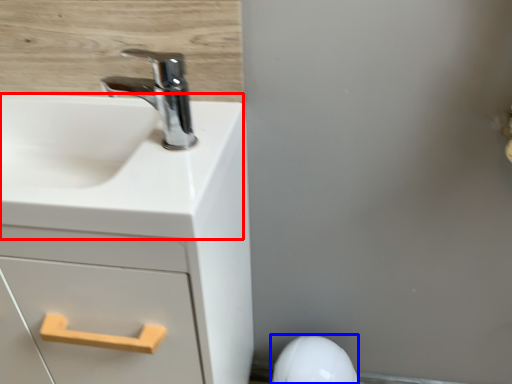
Question: Which point is closer to the camera, counter top (highlighted by a red box) or porcelain (highlighted by a blue box)?

Choices:
 (A) counter top
 (B) porcelain

Answer: (A)